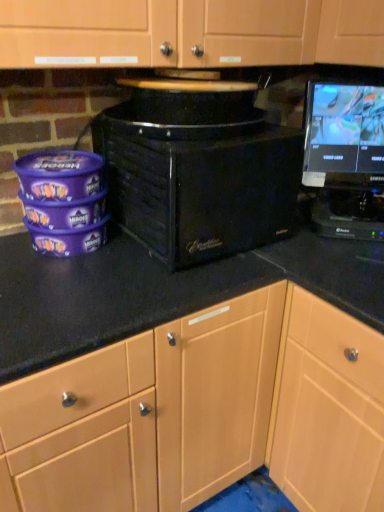
The width and height of the screenshot is (384, 512). Find the location of `free space underneath black glossy monitor at upper right (from a real-world perspective)`. free space underneath black glossy monitor at upper right (from a real-world perspective) is located at coordinates (351, 217).